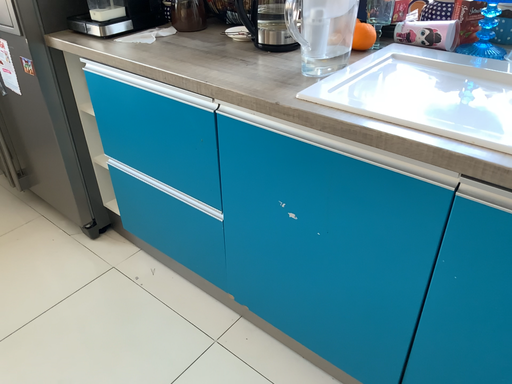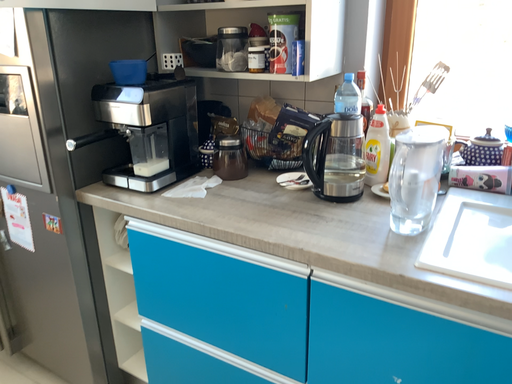
Question: How did the camera likely rotate when shooting the video?

Choices:
 (A) rotated upward
 (B) rotated downward

Answer: (A)